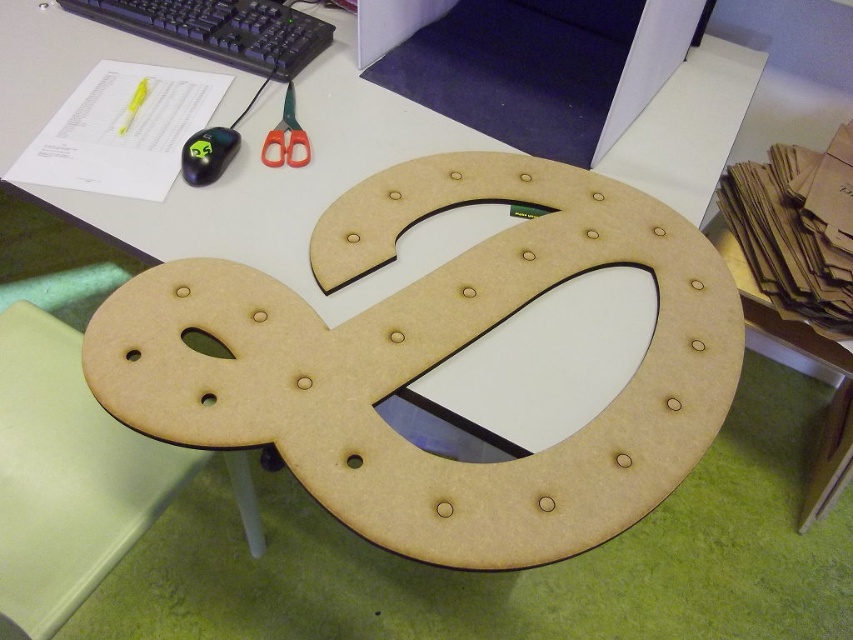
Question: Which point is closer to the camera?

Choices:
 (A) (142, 92)
 (B) (521, 230)
 (C) (64, 3)
 (D) (292, 140)

Answer: (B)

Question: Does green plastic scissors at upper center appear under yellow plastic highlighter at upper left?

Choices:
 (A) yes
 (B) no

Answer: (A)

Question: Which of the following is the farthest from the observer?

Choices:
 (A) (276, 44)
 (B) (117, 131)
 (C) (294, 131)
 (D) (317, 358)

Answer: (A)

Question: Which of the following is the farthest from the observer?

Choices:
 (A) click(x=293, y=109)
 (B) click(x=442, y=481)
 (C) click(x=234, y=32)

Answer: (C)

Question: Is black plastic keyboard at upper left to the left of green plastic scissors at upper center from the viewer's perspective?

Choices:
 (A) no
 (B) yes

Answer: (B)

Question: Is black plastic keyboard at upper left smaller than green plastic scissors at upper center?

Choices:
 (A) no
 (B) yes

Answer: (A)